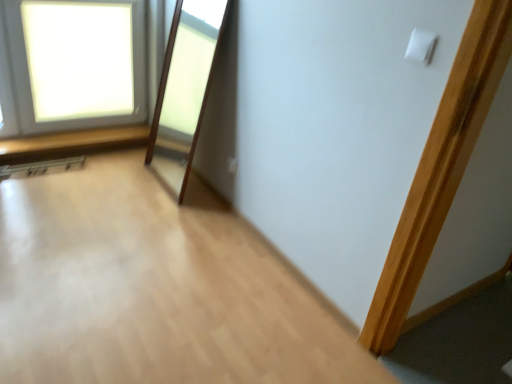
Question: From the image's perspective, is white plastic electric outlet at upper center above white matte light switch at upper right?

Choices:
 (A) yes
 (B) no

Answer: (B)

Question: Considering the relative sizes of white plastic electric outlet at upper center and white matte light switch at upper right in the image provided, is white plastic electric outlet at upper center thinner than white matte light switch at upper right?

Choices:
 (A) yes
 (B) no

Answer: (B)

Question: Is white plastic electric outlet at upper center at the right side of white matte light switch at upper right?

Choices:
 (A) yes
 (B) no

Answer: (B)

Question: Considering the relative sizes of white plastic electric outlet at upper center and white matte light switch at upper right in the image provided, is white plastic electric outlet at upper center shorter than white matte light switch at upper right?

Choices:
 (A) no
 (B) yes

Answer: (B)

Question: Does white plastic electric outlet at upper center lie behind white matte light switch at upper right?

Choices:
 (A) no
 (B) yes

Answer: (B)

Question: Relative to white plastic electric outlet at upper center, is white frosted glass window at upper left in front or behind?

Choices:
 (A) behind
 (B) front

Answer: (B)

Question: Is white frosted glass window at upper left inside or outside of white plastic electric outlet at upper center?

Choices:
 (A) inside
 (B) outside

Answer: (B)

Question: Is point (98, 44) positioned closer to the camera than point (236, 170)?

Choices:
 (A) closer
 (B) farther

Answer: (B)

Question: Considering the positions of white frosted glass window at upper left and white plastic electric outlet at upper center in the image, is white frosted glass window at upper left wider or thinner than white plastic electric outlet at upper center?

Choices:
 (A) wide
 (B) thin

Answer: (A)

Question: From a real-world perspective, is white plastic electric outlet at upper center above or below white frosted glass window at upper left?

Choices:
 (A) above
 (B) below

Answer: (B)

Question: Visually, is white plastic electric outlet at upper center positioned to the left or to the right of white frosted glass window at upper left?

Choices:
 (A) left
 (B) right

Answer: (B)

Question: Is white plastic electric outlet at upper center in front of or behind white frosted glass window at upper left in the image?

Choices:
 (A) behind
 (B) front

Answer: (A)

Question: Does point (230, 168) appear closer or farther from the camera than point (61, 86)?

Choices:
 (A) farther
 (B) closer

Answer: (B)

Question: From the image's perspective, is white frosted glass window at upper left above or below white matte light switch at upper right?

Choices:
 (A) below
 (B) above

Answer: (B)

Question: Choose the correct answer: Is white frosted glass window at upper left inside white matte light switch at upper right or outside it?

Choices:
 (A) outside
 (B) inside

Answer: (A)